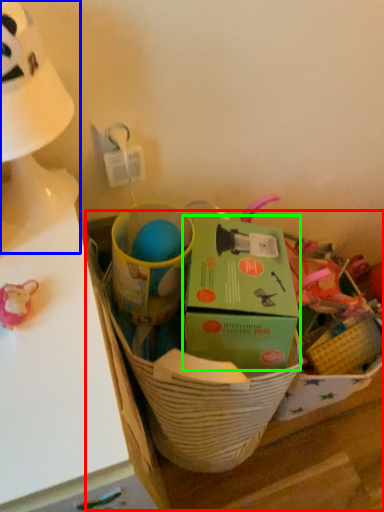
Question: Estimate the real-world distances between objects in this image. Which object is closer to cardboard box (highlighted by a red box), table lamp (highlighted by a blue box) or box (highlighted by a green box)?

Choices:
 (A) table lamp
 (B) box

Answer: (B)